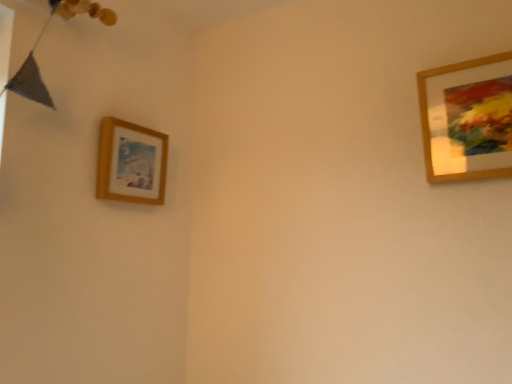
Where is `wooden picture frame at upper left, the second picture frame viewed from the front`? This screenshot has width=512, height=384. wooden picture frame at upper left, the second picture frame viewed from the front is located at coordinates (131, 163).

This screenshot has height=384, width=512. Describe the element at coordinates (131, 163) in the screenshot. I see `wooden picture frame at upper left, arranged as the 2th picture frame when viewed from the right` at that location.

This screenshot has width=512, height=384. What do you see at coordinates (467, 119) in the screenshot?
I see `wooden picture frame at upper right, positioned as the second picture frame in left-to-right order` at bounding box center [467, 119].

Locate an element on the screen. This screenshot has height=384, width=512. wooden picture frame at upper right, placed as the 1th picture frame when sorted from right to left is located at coordinates (467, 119).

Identify the location of wooden picture frame at upper left, placed as the 1th picture frame when sorted from back to front. The height and width of the screenshot is (384, 512). (131, 163).

Which is more to the right, wooden picture frame at upper right, acting as the first picture frame starting from the front, or wooden picture frame at upper left, which is counted as the first picture frame, starting from the left?

Positioned to the right is wooden picture frame at upper right, acting as the first picture frame starting from the front.

In the image, is wooden picture frame at upper right, acting as the first picture frame starting from the front, positioned in front of or behind wooden picture frame at upper left, the second picture frame viewed from the front?

Visually, wooden picture frame at upper right, acting as the first picture frame starting from the front, is located in front of wooden picture frame at upper left, the second picture frame viewed from the front.

Does point (503, 62) come farther from viewer compared to point (161, 168)?

No, it is not.

From the image's perspective, does wooden picture frame at upper right, placed as the 1th picture frame when sorted from right to left, appear lower than wooden picture frame at upper left, placed as the 1th picture frame when sorted from back to front?

No, from the image's perspective, wooden picture frame at upper right, placed as the 1th picture frame when sorted from right to left, is not beneath wooden picture frame at upper left, placed as the 1th picture frame when sorted from back to front.

From a real-world perspective, relative to wooden picture frame at upper left, which is counted as the first picture frame, starting from the left, is wooden picture frame at upper right, acting as the second picture frame starting from the back, vertically above or below?

wooden picture frame at upper right, acting as the second picture frame starting from the back, is situated higher than wooden picture frame at upper left, which is counted as the first picture frame, starting from the left, in the real world.

Between wooden picture frame at upper right, acting as the first picture frame starting from the front, and wooden picture frame at upper left, placed as the 1th picture frame when sorted from back to front, which one has larger width?

Answer: wooden picture frame at upper left, placed as the 1th picture frame when sorted from back to front.

Between wooden picture frame at upper right, acting as the first picture frame starting from the front, and wooden picture frame at upper left, the second picture frame viewed from the front, which one has less height?

With less height is wooden picture frame at upper left, the second picture frame viewed from the front.

Looking at the image, does wooden picture frame at upper right, placed as the 1th picture frame when sorted from right to left, seem bigger or smaller compared to wooden picture frame at upper left, the second picture frame viewed from the front?

Considering their sizes, wooden picture frame at upper right, placed as the 1th picture frame when sorted from right to left, takes up more space than wooden picture frame at upper left, the second picture frame viewed from the front.

Is wooden picture frame at upper right, positioned as the second picture frame in left-to-right order, inside the boundaries of wooden picture frame at upper left, the second picture frame viewed from the front, or outside?

wooden picture frame at upper right, positioned as the second picture frame in left-to-right order, is not enclosed by wooden picture frame at upper left, the second picture frame viewed from the front.

Is wooden picture frame at upper right, acting as the second picture frame starting from the back, next to wooden picture frame at upper left, the second picture frame viewed from the front, and touching it?

There is a gap between wooden picture frame at upper right, acting as the second picture frame starting from the back, and wooden picture frame at upper left, the second picture frame viewed from the front.

Consider the image. Is wooden picture frame at upper right, acting as the first picture frame starting from the front, looking in the opposite direction of wooden picture frame at upper left, placed as the 1th picture frame when sorted from back to front?

No, wooden picture frame at upper right, acting as the first picture frame starting from the front, is not facing the opposite direction of wooden picture frame at upper left, placed as the 1th picture frame when sorted from back to front.

Measure the distance between wooden picture frame at upper right, placed as the 1th picture frame when sorted from right to left, and wooden picture frame at upper left, arranged as the 2th picture frame when viewed from the right.

The distance of wooden picture frame at upper right, placed as the 1th picture frame when sorted from right to left, from wooden picture frame at upper left, arranged as the 2th picture frame when viewed from the right, is 94.92 centimeters.

At what (x,y) coordinates should I click in order to perform the action: click on picture frame located on the left of wooden picture frame at upper right, acting as the second picture frame starting from the back. Please return your answer as a coordinate pair (x, y). Image resolution: width=512 pixels, height=384 pixels. Looking at the image, I should click on (131, 163).

Would you say wooden picture frame at upper left, the second picture frame viewed from the front, is to the left or to the right of wooden picture frame at upper right, acting as the second picture frame starting from the back, in the picture?

wooden picture frame at upper left, the second picture frame viewed from the front, is to the left of wooden picture frame at upper right, acting as the second picture frame starting from the back.

Between wooden picture frame at upper left, which is counted as the first picture frame, starting from the left, and wooden picture frame at upper right, positioned as the second picture frame in left-to-right order, which one is positioned in front?

wooden picture frame at upper right, positioned as the second picture frame in left-to-right order, is more forward.

Does point (147, 145) lie in front of point (457, 99)?

No, (147, 145) is behind (457, 99).

From the image's perspective, is wooden picture frame at upper left, arranged as the 2th picture frame when viewed from the right, over wooden picture frame at upper right, positioned as the second picture frame in left-to-right order?

Incorrect, from the image's perspective, wooden picture frame at upper left, arranged as the 2th picture frame when viewed from the right, is lower than wooden picture frame at upper right, positioned as the second picture frame in left-to-right order.

From a real-world perspective, is wooden picture frame at upper left, arranged as the 2th picture frame when viewed from the right, beneath wooden picture frame at upper right, acting as the first picture frame starting from the front?

Yes, from a real-world perspective, wooden picture frame at upper left, arranged as the 2th picture frame when viewed from the right, is below wooden picture frame at upper right, acting as the first picture frame starting from the front.

Does wooden picture frame at upper left, which is counted as the first picture frame, starting from the left, have a greater width compared to wooden picture frame at upper right, placed as the 1th picture frame when sorted from right to left?

Correct, the width of wooden picture frame at upper left, which is counted as the first picture frame, starting from the left, exceeds that of wooden picture frame at upper right, placed as the 1th picture frame when sorted from right to left.

In terms of height, does wooden picture frame at upper left, placed as the 1th picture frame when sorted from back to front, look taller or shorter compared to wooden picture frame at upper right, placed as the 1th picture frame when sorted from right to left?

Clearly, wooden picture frame at upper left, placed as the 1th picture frame when sorted from back to front, is shorter compared to wooden picture frame at upper right, placed as the 1th picture frame when sorted from right to left.

Between wooden picture frame at upper left, placed as the 1th picture frame when sorted from back to front, and wooden picture frame at upper right, acting as the second picture frame starting from the back, which one has smaller size?

With smaller size is wooden picture frame at upper left, placed as the 1th picture frame when sorted from back to front.

Is wooden picture frame at upper left, arranged as the 2th picture frame when viewed from the right, outside of wooden picture frame at upper right, placed as the 1th picture frame when sorted from right to left?

Yes, wooden picture frame at upper left, arranged as the 2th picture frame when viewed from the right, is not within wooden picture frame at upper right, placed as the 1th picture frame when sorted from right to left.

Are wooden picture frame at upper left, the second picture frame viewed from the front, and wooden picture frame at upper right, positioned as the second picture frame in left-to-right order, far apart?

They are positioned close to each other.

Is wooden picture frame at upper left, which is counted as the first picture frame, starting from the left, oriented away from wooden picture frame at upper right, positioned as the second picture frame in left-to-right order?

wooden picture frame at upper left, which is counted as the first picture frame, starting from the left, is not turned away from wooden picture frame at upper right, positioned as the second picture frame in left-to-right order.

How different are the orientations of wooden picture frame at upper left, arranged as the 2th picture frame when viewed from the right, and wooden picture frame at upper right, acting as the second picture frame starting from the back, in degrees?

90 degrees separate the facing orientations of wooden picture frame at upper left, arranged as the 2th picture frame when viewed from the right, and wooden picture frame at upper right, acting as the second picture frame starting from the back.

What are the coordinates of `picture frame that appears above the wooden picture frame at upper left, placed as the 1th picture frame when sorted from back to front (from a real-world perspective)` in the screenshot? It's located at (467, 119).

This screenshot has height=384, width=512. What are the coordinates of `picture frame behind the wooden picture frame at upper right, positioned as the second picture frame in left-to-right order` in the screenshot? It's located at (131, 163).

At what (x,y) coordinates should I click in order to perform the action: click on picture frame above the wooden picture frame at upper left, placed as the 1th picture frame when sorted from back to front (from a real-world perspective). Please return your answer as a coordinate pair (x, y). Looking at the image, I should click on (467, 119).